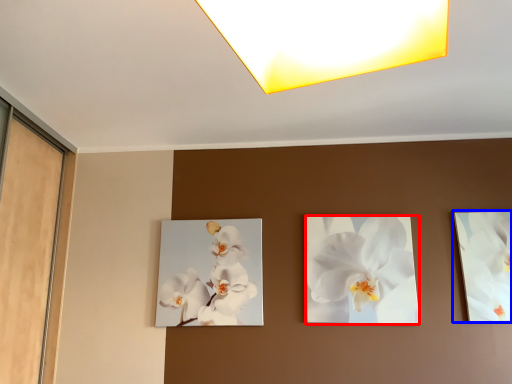
Question: Which object is further to the camera taking this photo, flower (highlighted by a red box) or picture frame (highlighted by a blue box)?

Choices:
 (A) flower
 (B) picture frame

Answer: (A)